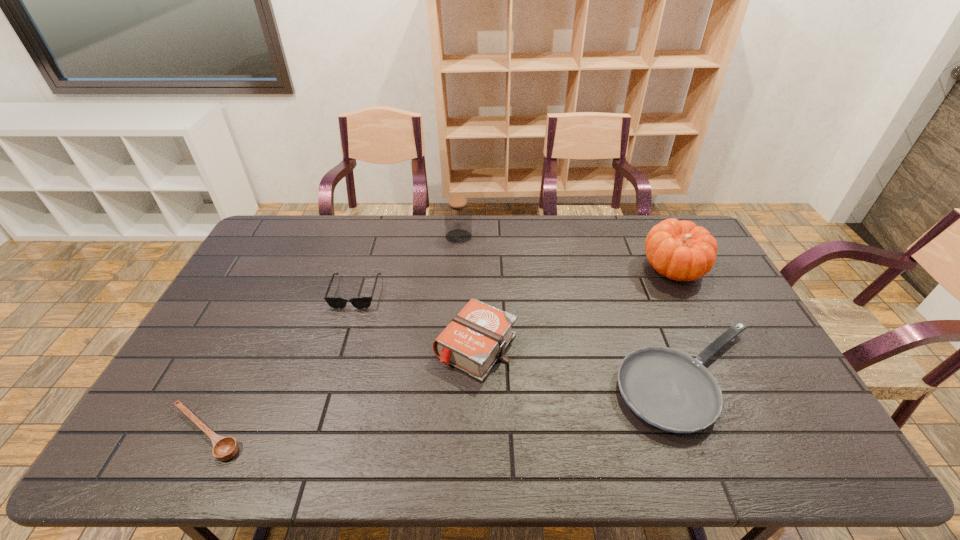
This screenshot has width=960, height=540. I want to click on free space located on the right of the third tallest object, so click(x=617, y=347).

This screenshot has height=540, width=960. What are the coordinates of `vacant space located 0.070m at the front lenses of the sunglasses` in the screenshot? It's located at (346, 326).

You are a GUI agent. You are given a task and a screenshot of the screen. Output one action in this format:
    pyautogui.click(x=<x>, y=<y>)
    Task: Click on the vacant position located 0.170m on the back of the fifth tallest object
    The height and width of the screenshot is (540, 960).
    Given the screenshot: What is the action you would take?
    pyautogui.click(x=653, y=290)

You are a GUI agent. You are given a task and a screenshot of the screen. Output one action in this format:
    pyautogui.click(x=<x>, y=<y>)
    Task: Click on the free space located on the back of the leftmost object
    This screenshot has width=960, height=540.
    Given the screenshot: What is the action you would take?
    pyautogui.click(x=270, y=304)

This screenshot has height=540, width=960. Find the location of `jar that is at the far edge`. jar that is at the far edge is located at coordinates (458, 216).

Find the location of a particular element. This screenshot has height=540, width=960. pumpkin at the far edge is located at coordinates (679, 250).

Image resolution: width=960 pixels, height=540 pixels. I want to click on frying pan positioned at the near edge, so click(669, 389).

Identify the location of wooden spoon at the near edge. (224, 448).

Where is `object located in the left edge section of the desktop`? The height and width of the screenshot is (540, 960). object located in the left edge section of the desktop is located at coordinates (224, 448).

I want to click on pumpkin positioned at the right edge, so click(679, 250).